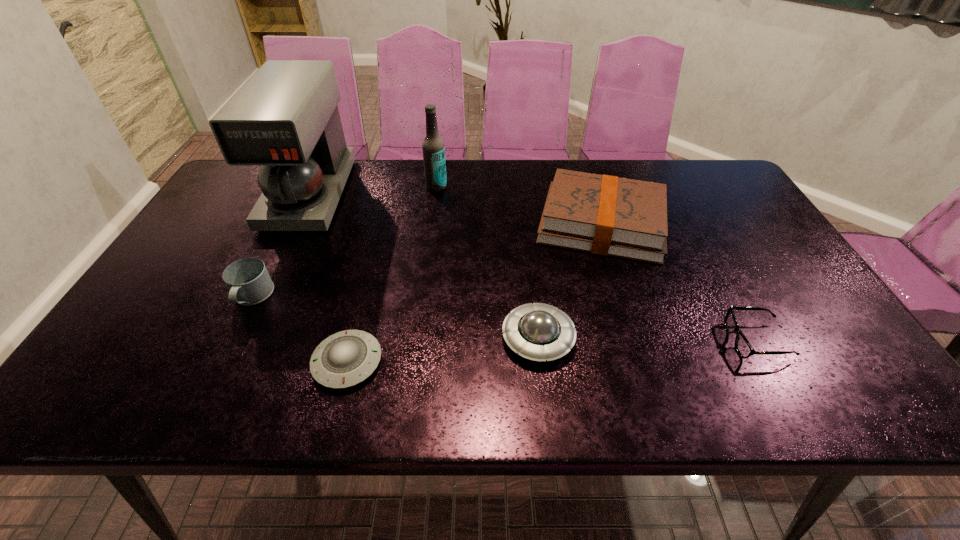
The height and width of the screenshot is (540, 960). I want to click on the tallest object, so click(285, 119).

Identify the location of beer bottle. (433, 148).

I want to click on the second tallest object, so click(x=433, y=148).

You are a GUI agent. You are given a task and a screenshot of the screen. Output one action in this format:
    pyautogui.click(x=<x>, y=<y>)
    Task: Click on the third tallest object
    The image size is (960, 540).
    Given the screenshot: What is the action you would take?
    pyautogui.click(x=607, y=215)

The image size is (960, 540). In order to click on mug in this screenshot , I will do `click(248, 281)`.

Locate an element on the screen. This screenshot has height=540, width=960. the taller saucer is located at coordinates (539, 332).

Where is `the rightmost object`? The image size is (960, 540). the rightmost object is located at coordinates (744, 349).

Find the location of a particular element. This screenshot has width=960, height=540. the fifth object from right to left is located at coordinates (346, 358).

The height and width of the screenshot is (540, 960). Find the location of `the left saucer`. the left saucer is located at coordinates (346, 358).

Find the location of a particular element. vacant position located on the carafe side of the coffee maker is located at coordinates (261, 298).